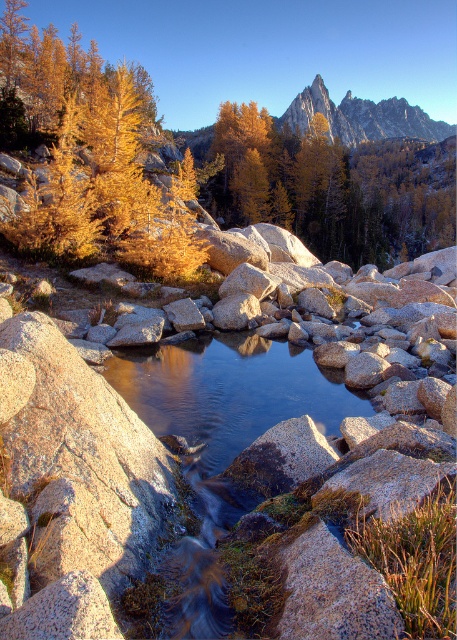
Does golden larch tree at upper left have a larger size compared to sharp granite peak at upper center?

Actually, golden larch tree at upper left might be smaller than sharp granite peak at upper center.

Does point (58, 198) lie in front of point (396, 120)?

Yes, it is in front of point (396, 120).

Is point (138, 100) positioned after point (298, 115)?

No, it is in front of (298, 115).

This screenshot has height=640, width=457. I want to click on golden larch tree at upper left, so click(x=93, y=154).